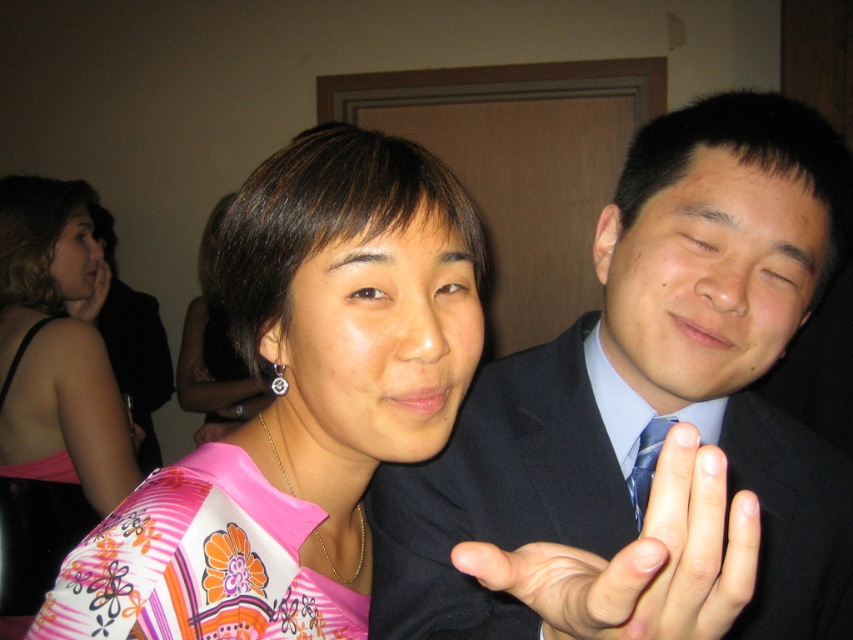
Between pink floral dress at center and pink floral fabric dress at left, which one is positioned higher?

pink floral dress at center

Identify the location of pink floral dress at center. (53, 387).

Which is in front, point (260, 404) or point (201, 436)?

Point (201, 436) is more forward.

Which is more to the right, pink fabric at center or pink fabric hand at center?

pink fabric hand at center

Which is behind, point (187, 384) or point (216, 440)?

Positioned behind is point (187, 384).

What are the coordinates of `pink fabric at center` in the screenshot? It's located at (213, 346).

Is point (634, 497) closer to viewer compared to point (206, 420)?

Yes, point (634, 497) is in front of point (206, 420).

Does blue silk tie at center appear under pink fabric hand at center?

Incorrect, blue silk tie at center is not positioned below pink fabric hand at center.

Who is more forward, [633,488] or [201,442]?

Positioned in front is point [633,488].

Identify the location of blue silk tie at center. (646, 465).